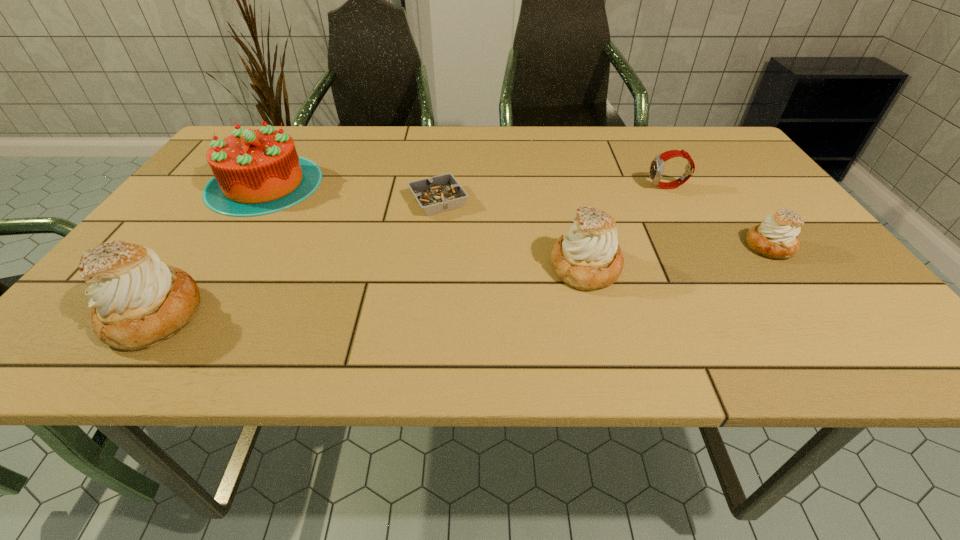
The image size is (960, 540). Find the location of `free location that satisfies the following two spatial constraints: 1. on the front side of the ashtray; 2. on the right side of the rightmost object`. free location that satisfies the following two spatial constraints: 1. on the front side of the ashtray; 2. on the right side of the rightmost object is located at coordinates (433, 247).

At what (x,y) coordinates should I click in order to perform the action: click on free spot that satisfies the following two spatial constraints: 1. on the back side of the leftmost pastry; 2. on the left side of the cake. Please return your answer as a coordinate pair (x, y). The image size is (960, 540). Looking at the image, I should click on (246, 184).